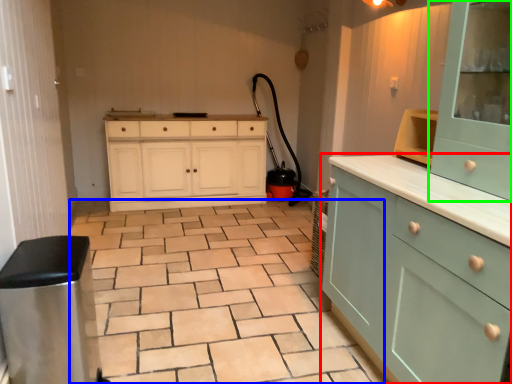
Question: Considering the real-world distances, which object is closest to cabinetry (highlighted by a red box)? ceramic tile (highlighted by a blue box) or cabinetry (highlighted by a green box).

Choices:
 (A) ceramic tile
 (B) cabinetry

Answer: (B)